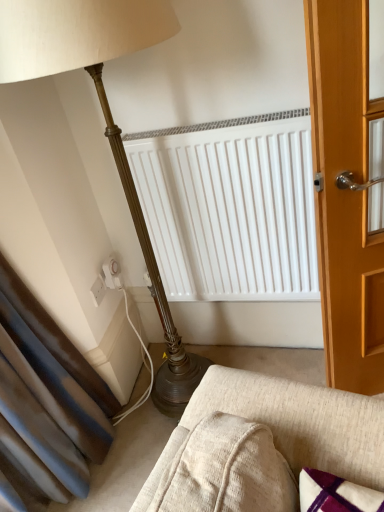
Question: Considering the relative positions of white plastic electric outlet at lower left, the 2th electric outlet when ordered from right to left, and textured beige fabric couch at lower center in the image provided, is white plastic electric outlet at lower left, the 2th electric outlet when ordered from right to left, to the left of textured beige fabric couch at lower center from the viewer's perspective?

Choices:
 (A) no
 (B) yes

Answer: (B)

Question: Is white plastic electric outlet at lower left, marked as the first electric outlet in a left-to-right arrangement, directly adjacent to textured beige fabric couch at lower center?

Choices:
 (A) no
 (B) yes

Answer: (A)

Question: From a real-world perspective, is white plastic electric outlet at lower left, the 2th electric outlet when ordered from right to left, on textured beige fabric couch at lower center?

Choices:
 (A) yes
 (B) no

Answer: (A)

Question: Can you confirm if white plastic electric outlet at lower left, the 2th electric outlet when ordered from right to left, is thinner than textured beige fabric couch at lower center?

Choices:
 (A) yes
 (B) no

Answer: (A)

Question: From the image's perspective, is white plastic electric outlet at lower left, the 2th electric outlet when ordered from right to left, under textured beige fabric couch at lower center?

Choices:
 (A) yes
 (B) no

Answer: (B)

Question: Does white plastic electric outlet at lower left, the 2th electric outlet when ordered from right to left, have a greater width compared to textured beige fabric couch at lower center?

Choices:
 (A) no
 (B) yes

Answer: (A)

Question: Is the surface of white plastic electric outlet at lower left, which is the 1th electric outlet from right to left, in direct contact with textured beige fabric couch at lower center?

Choices:
 (A) no
 (B) yes

Answer: (A)

Question: Does white plastic electric outlet at lower left, which is the 1th electric outlet from right to left, come behind textured beige fabric couch at lower center?

Choices:
 (A) no
 (B) yes

Answer: (B)

Question: Can we say white plastic electric outlet at lower left, the 2th electric outlet from the left, lies outside textured beige fabric couch at lower center?

Choices:
 (A) yes
 (B) no

Answer: (A)

Question: Considering the relative sizes of white plastic electric outlet at lower left, the 2th electric outlet from the left, and textured beige fabric couch at lower center in the image provided, is white plastic electric outlet at lower left, the 2th electric outlet from the left, bigger than textured beige fabric couch at lower center?

Choices:
 (A) no
 (B) yes

Answer: (A)

Question: From a real-world perspective, is white plastic electric outlet at lower left, the 2th electric outlet from the left, positioned over textured beige fabric couch at lower center based on gravity?

Choices:
 (A) yes
 (B) no

Answer: (A)

Question: From the image's perspective, is white plastic electric outlet at lower left, which is the 1th electric outlet from right to left, beneath textured beige fabric couch at lower center?

Choices:
 (A) yes
 (B) no

Answer: (B)

Question: From a real-world perspective, is textured beige fabric couch at lower center positioned over white plastic electric outlet at lower left, the 2th electric outlet when ordered from right to left, based on gravity?

Choices:
 (A) no
 (B) yes

Answer: (A)